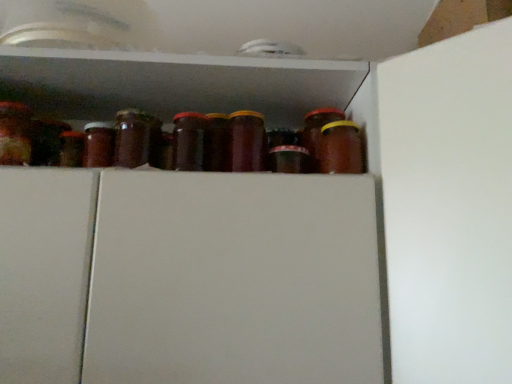
Question: Considering the relative positions of brown glass jar at center, which is counted as the 1th bottle, starting from the left, and brown glass jar at center-right, which is the 2th bottle in left-to-right order, in the image provided, is brown glass jar at center, which is counted as the 1th bottle, starting from the left, to the right of brown glass jar at center-right, which is the 2th bottle in left-to-right order, from the viewer's perspective?

Choices:
 (A) yes
 (B) no

Answer: (B)

Question: Does brown glass jar at center, which is counted as the 1th bottle, starting from the left, have a smaller size compared to brown glass jar at center-right, which is the 2th bottle in left-to-right order?

Choices:
 (A) no
 (B) yes

Answer: (A)

Question: Is brown glass jar at center, which is counted as the 1th bottle, starting from the left, touching brown glass jar at center-right, which is the first bottle from right to left?

Choices:
 (A) yes
 (B) no

Answer: (B)

Question: Can brown glass jar at center-right, which is the 2th bottle in left-to-right order, be found inside brown glass jar at center, which is counted as the 1th bottle, starting from the left?

Choices:
 (A) no
 (B) yes

Answer: (A)

Question: From a real-world perspective, is brown glass jar at center, which is counted as the 1th bottle, starting from the left, physically below brown glass jar at center-right, which is the 2th bottle in left-to-right order?

Choices:
 (A) yes
 (B) no

Answer: (B)

Question: Can you confirm if brown glass jar at center, acting as the second bottle starting from the right, is thinner than brown glass jar at center-right, which is the 2th bottle in left-to-right order?

Choices:
 (A) yes
 (B) no

Answer: (A)

Question: Could you tell me if brown glass jar at center-right, which is the first bottle from right to left, is facing brown glass jar at center, which is counted as the 1th bottle, starting from the left?

Choices:
 (A) yes
 (B) no

Answer: (B)

Question: Considering the relative sizes of brown glass jar at center-right, which is the first bottle from right to left, and brown glass jar at center, which is counted as the 1th bottle, starting from the left, in the image provided, is brown glass jar at center-right, which is the first bottle from right to left, shorter than brown glass jar at center, which is counted as the 1th bottle, starting from the left,?

Choices:
 (A) no
 (B) yes

Answer: (B)

Question: Is brown glass jar at center-right, which is the first bottle from right to left, directly adjacent to brown glass jar at center, which is counted as the 1th bottle, starting from the left?

Choices:
 (A) yes
 (B) no

Answer: (B)

Question: Is the depth of brown glass jar at center-right, which is the 2th bottle in left-to-right order, less than that of brown glass jar at center, which is counted as the 1th bottle, starting from the left?

Choices:
 (A) yes
 (B) no

Answer: (B)

Question: Is brown glass jar at center-right, which is the first bottle from right to left, oriented away from brown glass jar at center, acting as the second bottle starting from the right?

Choices:
 (A) yes
 (B) no

Answer: (B)

Question: Considering the relative positions of brown glass jar at center-right, which is the first bottle from right to left, and brown glass jar at center, acting as the second bottle starting from the right, in the image provided, is brown glass jar at center-right, which is the first bottle from right to left, to the right of brown glass jar at center, acting as the second bottle starting from the right, from the viewer's perspective?

Choices:
 (A) yes
 (B) no

Answer: (A)

Question: Is brown glass jar at center-right, which is the first bottle from right to left, bigger or smaller than brown glass jar at center, acting as the second bottle starting from the right?

Choices:
 (A) small
 (B) big

Answer: (A)